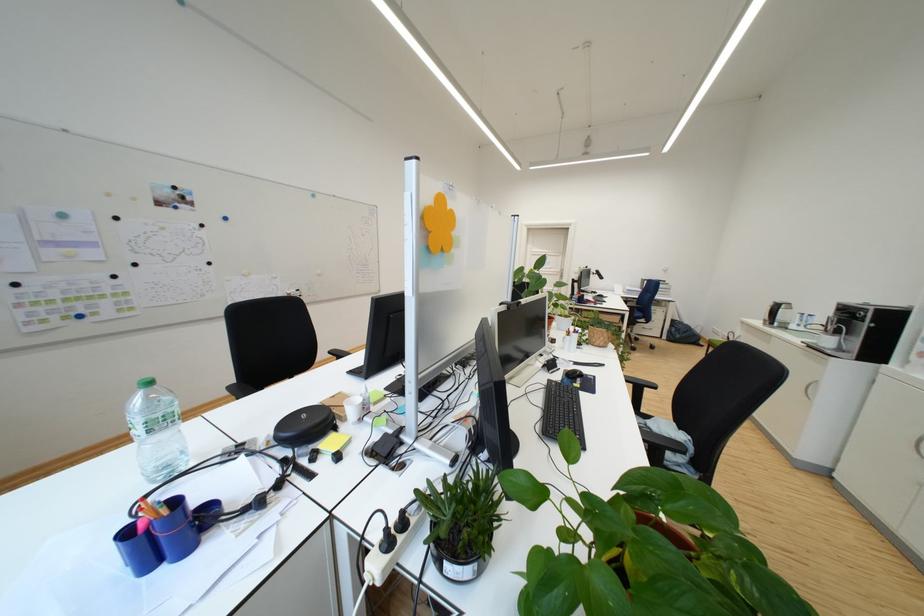
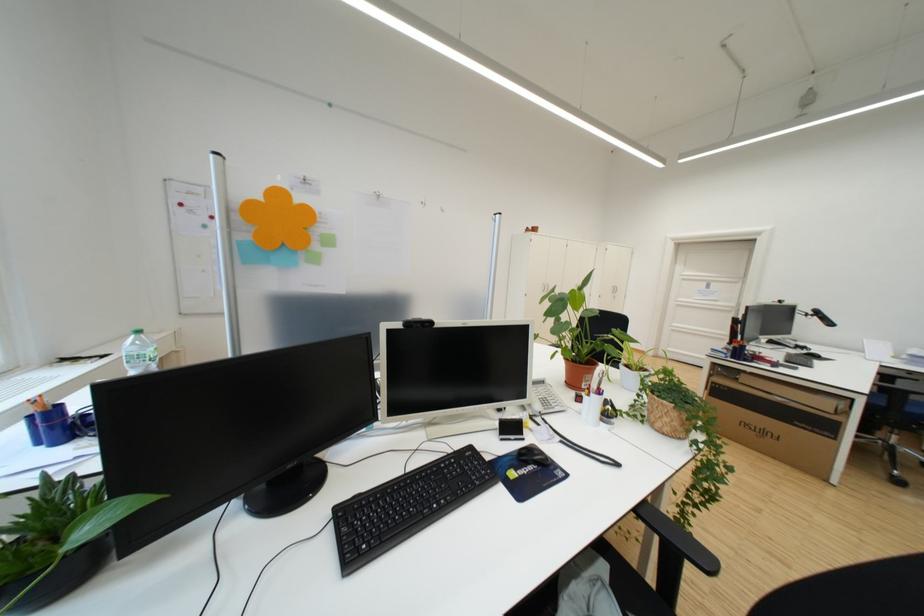
Find the pixel in the second image that matches [617,336] in the first image.

(687, 416)